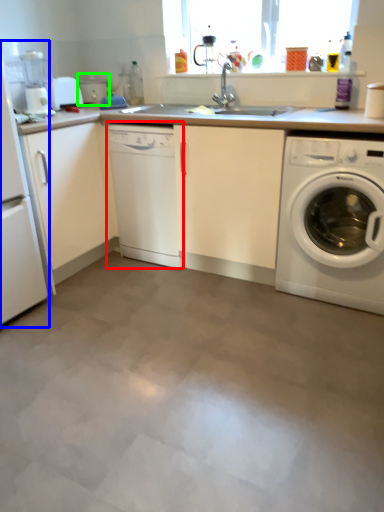
Question: Based on their relative distances, which object is nearer to dish washer (highlighted by a red box)? Choose from home appliance (highlighted by a blue box) and appliance (highlighted by a green box).

Choices:
 (A) home appliance
 (B) appliance

Answer: (A)